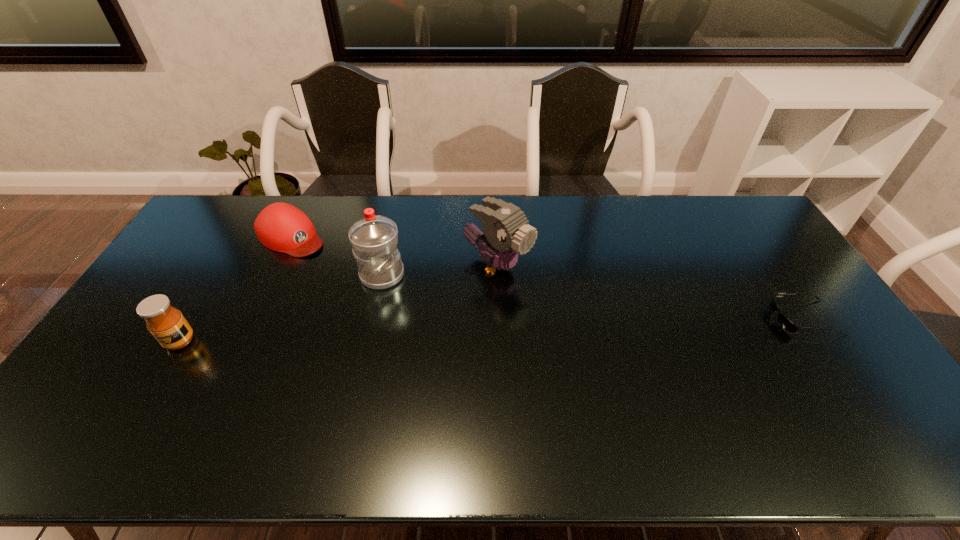
Image resolution: width=960 pixels, height=540 pixels. I want to click on free location that satisfies the following two spatial constraints: 1. on the back side of the fourth object from left to right; 2. on the right side of the third object from right to left, so [x=384, y=266].

At what (x,y) coordinates should I click in order to perform the action: click on free space that satisfies the following two spatial constraints: 1. on the front side of the bird; 2. on the front-facing side of the rightmost object. Please return your answer as a coordinate pair (x, y). Looking at the image, I should click on (499, 318).